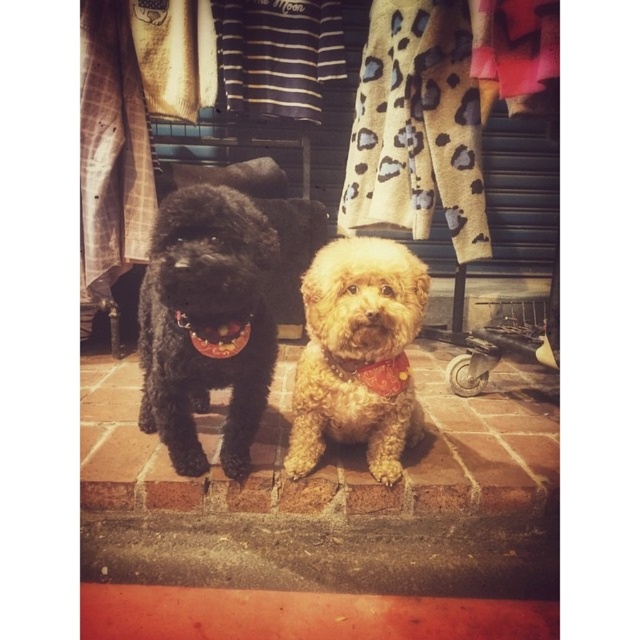
Question: Can you confirm if orange fabric neckband at center is positioned above red fabric neckband at center?

Choices:
 (A) yes
 (B) no

Answer: (B)

Question: Which object is positioned farthest from the red fabric neckband at center?

Choices:
 (A) shiny black dog at center
 (B) orange fabric neckband at center

Answer: (A)

Question: Which object is the closest to the shiny black dog at center?

Choices:
 (A) red fabric neckband at center
 (B) orange fabric neckband at center

Answer: (B)

Question: Does shiny black dog at center appear under orange fabric neckband at center?

Choices:
 (A) yes
 (B) no

Answer: (B)

Question: Considering the relative positions of shiny black dog at center and orange fabric neckband at center in the image provided, where is shiny black dog at center located with respect to orange fabric neckband at center?

Choices:
 (A) below
 (B) above

Answer: (B)

Question: Considering the real-world distances, which object is farthest from the shiny black dog at center?

Choices:
 (A) red fabric neckband at center
 (B) orange fabric neckband at center

Answer: (A)